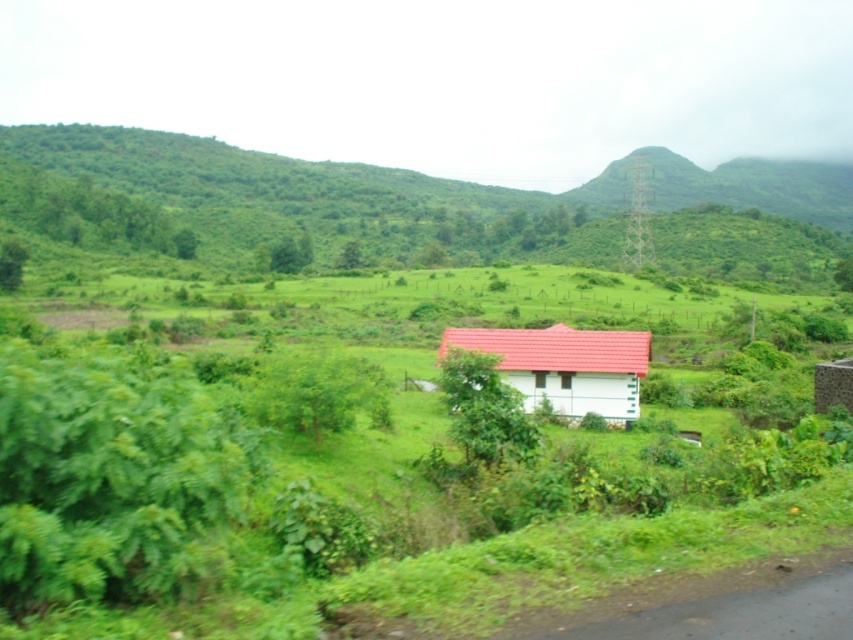
You are planning to set up a picnic area in the scene described. You have a picnic blanket that is 3 meters wide. You want to place it either on the green grassy hillside at left or near the white matte house at center. Based on the width of these areas, which location would allow the blanket to fit comfortably without overlapping the edges?

The green grassy hillside at left is wider than the white matte house at center, so placing the picnic blanket there would allow it to fit comfortably without overlapping the edges.

You are standing in the rural landscape and want to look through the transparent glass window at center. Can you see the green grassy hillside at left through it?

The transparent glass window at center is behind the green grassy hillside at left, so you cannot see the green grassy hillside at left through the window because the hillside is in front of the window.

You are standing outside the white matte house at center and want to look through the transparent glass train window at center. Which object is closer to you, the house or the window?

The white matte house at center is closer to you since it is in front of the transparent glass train window at center.